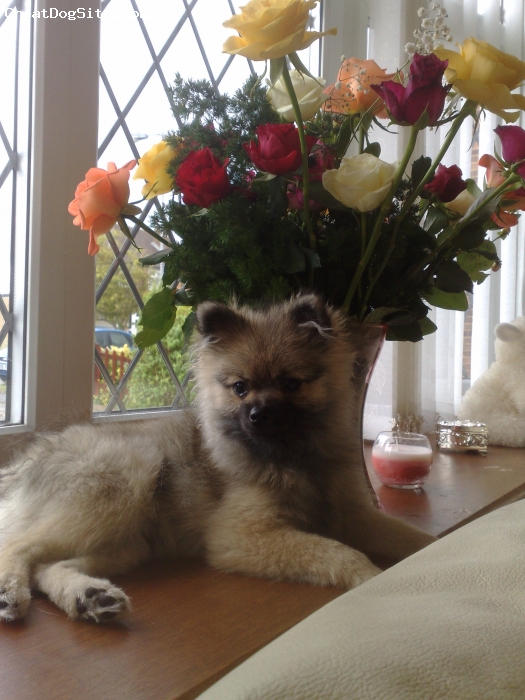
What are the coordinates of `pink candle in short round transparent glass` in the screenshot? It's located at (401, 465).